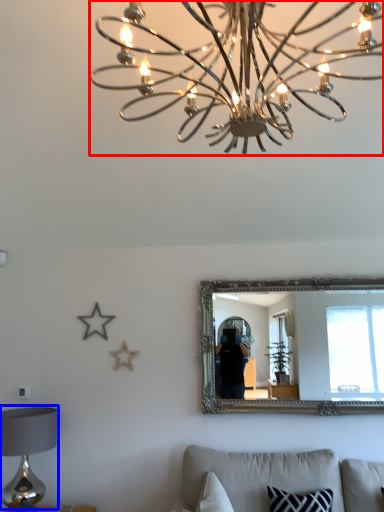
Question: Which object is closer to the camera taking this photo, lamp (highlighted by a red box) or table lamp (highlighted by a blue box)?

Choices:
 (A) lamp
 (B) table lamp

Answer: (A)